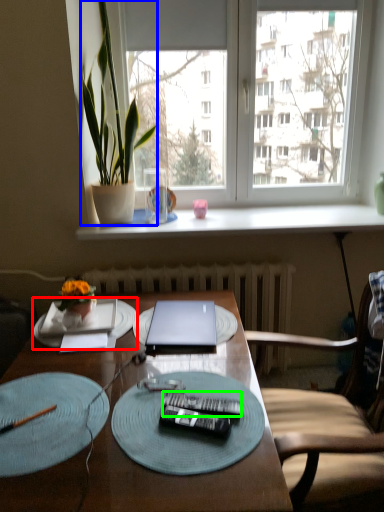
Question: Considering the real-world distances, which object is closest to platter (highlighted by a red box)? houseplant (highlighted by a blue box) or remote control (highlighted by a green box).

Choices:
 (A) houseplant
 (B) remote control

Answer: (B)